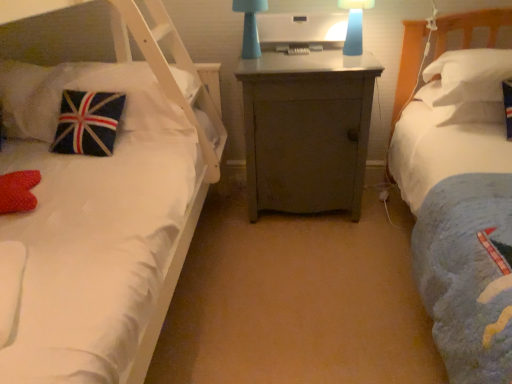
Locate an element on the screen. Image resolution: width=512 pixels, height=384 pixels. vacant area that is in front of gray matte cabinet at center is located at coordinates (307, 259).